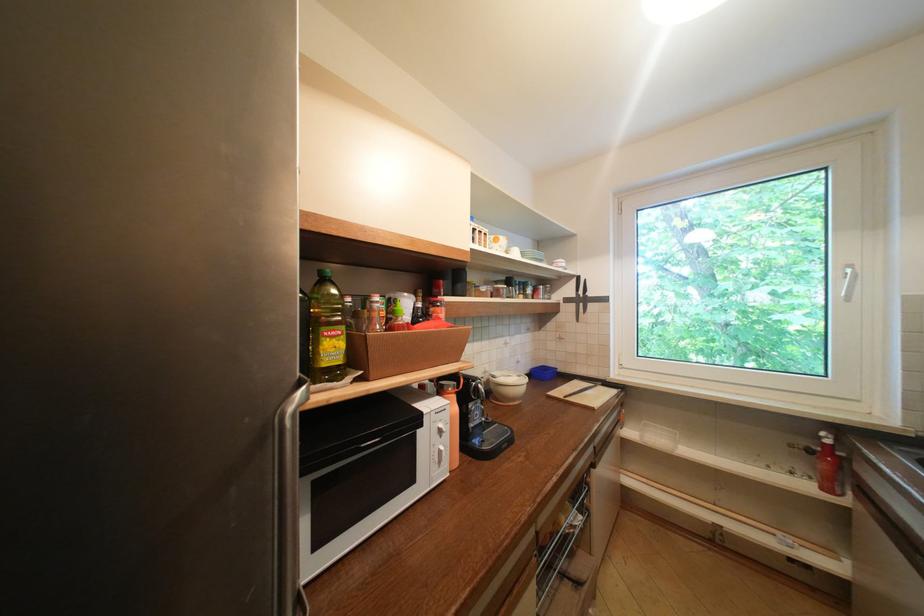
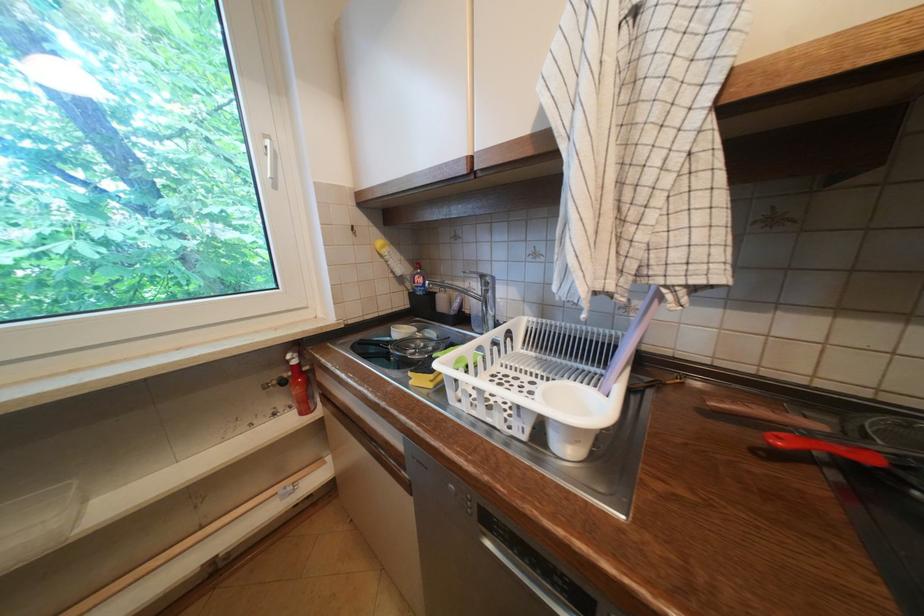
Find the pixel in the second image that matches point 829,439 in the first image.

(296, 362)